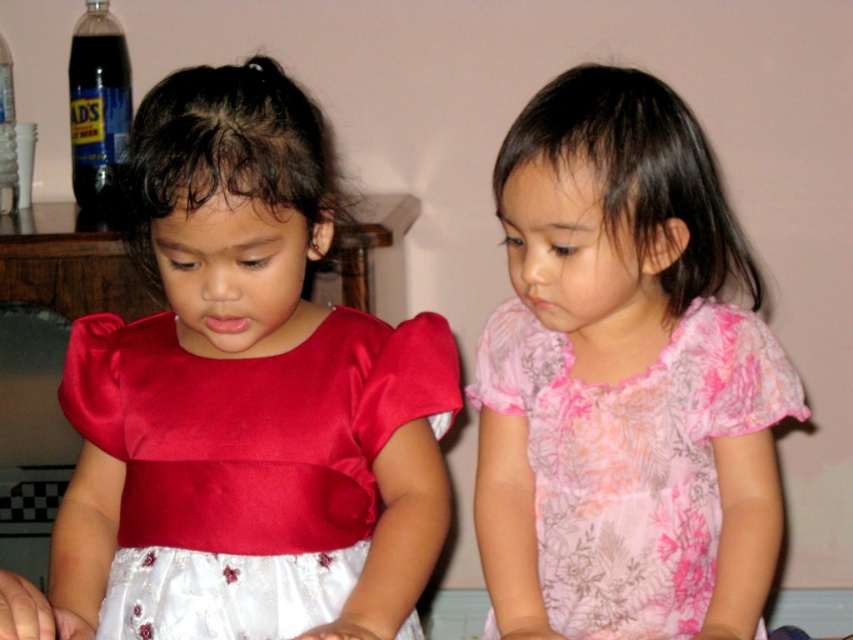
You are a photographer setting up a shoot. You need to ensure that the satin dress at left and the pink floral fabric dress at right are both visible in the frame. Given their positions, which dress is closer to the camera, and why?

The satin dress at left is positioned over the pink floral fabric dress at right, meaning it is closer to the camera. Since it is overlapping the other dress, it appears in front, making it the closer one.

You are a photographer setting up a shoot for a childrenswear catalog. You have two dresses to photograph today. The satin dress at left and the pink floral fabric dress at right. Based on their sizes, which dress should you recommend to a parent looking for a larger dress for their child?

The pink floral fabric dress at right is larger than the satin dress at left, so it would be the better recommendation for a parent seeking a larger dress for their child.

What object corresponds to the coordinates point (247, 465) in the image?

The satin dress at left corresponds to the coordinates point (247, 465).